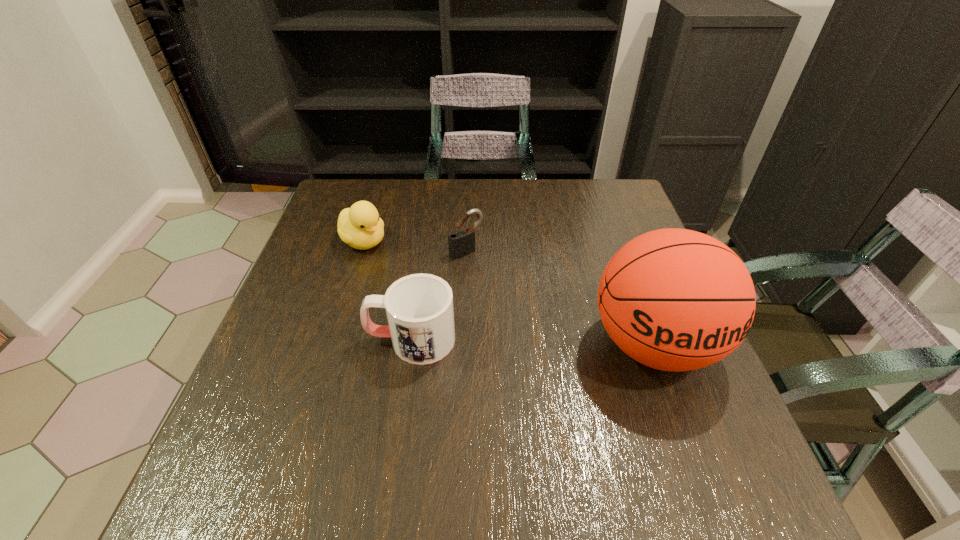
Locate an element on the screen. free location located on the front-facing side of the leftmost object is located at coordinates (408, 272).

Image resolution: width=960 pixels, height=540 pixels. What are the coordinates of `free space located on the front-facing side of the leftmost object` in the screenshot? It's located at (468, 313).

Find the location of a particular element. This screenshot has height=540, width=960. vacant space located with the keyhole on the front of the padlock is located at coordinates (515, 299).

Find the location of `blank space located with the keyhole on the front of the padlock`. blank space located with the keyhole on the front of the padlock is located at coordinates (569, 355).

Identify the location of free region located with the keyhole on the front of the padlock. (579, 366).

Locate an element on the screen. The image size is (960, 540). object that is at the left edge is located at coordinates (359, 226).

I want to click on object at the right edge, so click(673, 299).

At what (x,y) coordinates should I click in order to perform the action: click on free point at the far edge. Please return your answer as a coordinate pair (x, y). Image resolution: width=960 pixels, height=540 pixels. Looking at the image, I should click on (555, 210).

At what (x,y) coordinates should I click in order to perform the action: click on vacant area at the near edge of the desktop. Please return your answer as a coordinate pair (x, y). Looking at the image, I should click on (499, 415).

What are the coordinates of `vacant position at the left edge of the desktop` in the screenshot? It's located at (325, 253).